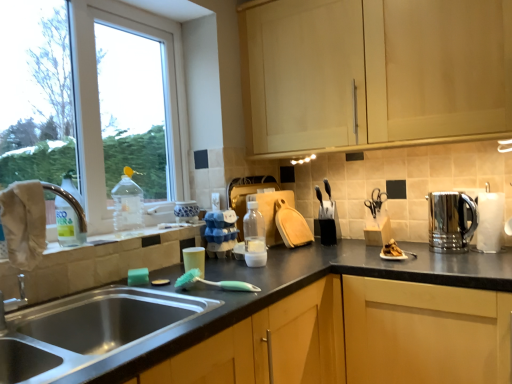
Question: From a real-world perspective, is stainless steel sink at lower left below black plastic knife block at upper right, which is the 2th appliance from left to right?

Choices:
 (A) yes
 (B) no

Answer: (A)

Question: Is stainless steel sink at lower left completely or partially outside of black plastic knife block at upper right, which is the 2th appliance from left to right?

Choices:
 (A) no
 (B) yes

Answer: (B)

Question: Considering the relative sizes of stainless steel sink at lower left and black plastic knife block at upper right, which is the 2th appliance from left to right, in the image provided, is stainless steel sink at lower left smaller than black plastic knife block at upper right, which is the 2th appliance from left to right,?

Choices:
 (A) yes
 (B) no

Answer: (B)

Question: Is the depth of stainless steel sink at lower left greater than that of black plastic knife block at upper right, which is the 2th appliance from left to right?

Choices:
 (A) yes
 (B) no

Answer: (B)

Question: Would you say stainless steel sink at lower left is a long distance from black plastic knife block at upper right, the 2th appliance from the right?

Choices:
 (A) yes
 (B) no

Answer: (A)

Question: Which is correct: white paper towel at right is inside translucent plastic bottle at center, placed as the 3th bottle when sorted from front to back, or outside of it?

Choices:
 (A) inside
 (B) outside

Answer: (B)

Question: From a real-world perspective, is white paper towel at right above or below translucent plastic bottle at center, which ranks as the first bottle in back-to-front order?

Choices:
 (A) below
 (B) above

Answer: (B)

Question: Considering the positions of white paper towel at right and translucent plastic bottle at center, which ranks as the first bottle in back-to-front order, in the image, is white paper towel at right taller or shorter than translucent plastic bottle at center, which ranks as the first bottle in back-to-front order,?

Choices:
 (A) short
 (B) tall

Answer: (B)

Question: Looking at their shapes, would you say white paper towel at right is wider or thinner than translucent plastic bottle at center, which ranks as the first bottle in back-to-front order?

Choices:
 (A) wide
 (B) thin

Answer: (A)

Question: In the image, is matte wood cabinet at upper center on the left side or the right side of polished stainless steel kettle at right, which is the first appliance in right-to-left order?

Choices:
 (A) right
 (B) left

Answer: (B)

Question: From a real-world perspective, is matte wood cabinet at upper center physically located above or below polished stainless steel kettle at right, positioned as the third appliance in left-to-right order?

Choices:
 (A) below
 (B) above

Answer: (B)

Question: From the image's perspective, is matte wood cabinet at upper center positioned above or below polished stainless steel kettle at right, positioned as the third appliance in left-to-right order?

Choices:
 (A) above
 (B) below

Answer: (A)

Question: Is matte wood cabinet at upper center wider or thinner than polished stainless steel kettle at right, positioned as the third appliance in left-to-right order?

Choices:
 (A) thin
 (B) wide

Answer: (B)

Question: Would you say polished stainless steel kettle at right, which is the first appliance in right-to-left order, is inside or outside white paper towel at right?

Choices:
 (A) inside
 (B) outside

Answer: (B)

Question: Considering the positions of polished stainless steel kettle at right, positioned as the third appliance in left-to-right order, and white paper towel at right in the image, is polished stainless steel kettle at right, positioned as the third appliance in left-to-right order, wider or thinner than white paper towel at right?

Choices:
 (A) thin
 (B) wide

Answer: (B)